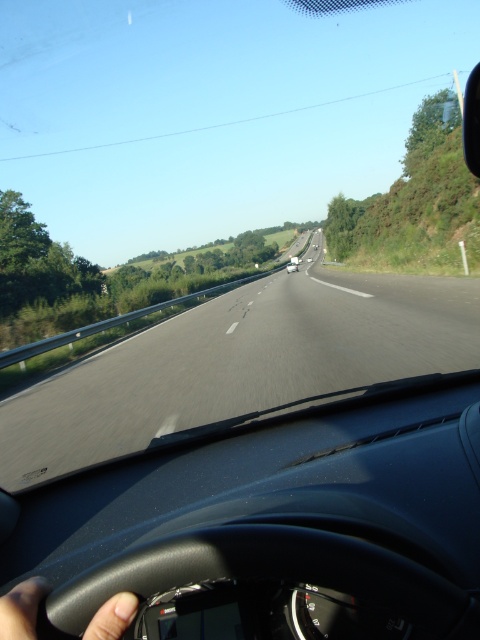
Question: Which of the following is the farthest from the observer?

Choices:
 (A) white glossy car at center
 (B) asphalt road at center

Answer: (A)

Question: Which object appears farthest from the camera in this image?

Choices:
 (A) white glossy car at center
 (B) asphalt road at center
 (C) black matte steering wheel at lower left

Answer: (A)

Question: Where is asphalt road at center located in relation to white glossy car at center in the image?

Choices:
 (A) right
 (B) left

Answer: (B)

Question: Can you confirm if black matte steering wheel at lower left is positioned above white glossy car at center?

Choices:
 (A) no
 (B) yes

Answer: (A)

Question: Which of the following is the farthest from the observer?

Choices:
 (A) (229, 305)
 (B) (126, 593)

Answer: (A)

Question: Considering the relative positions of asphalt road at center and black matte steering wheel at lower left in the image provided, where is asphalt road at center located with respect to black matte steering wheel at lower left?

Choices:
 (A) left
 (B) right

Answer: (B)